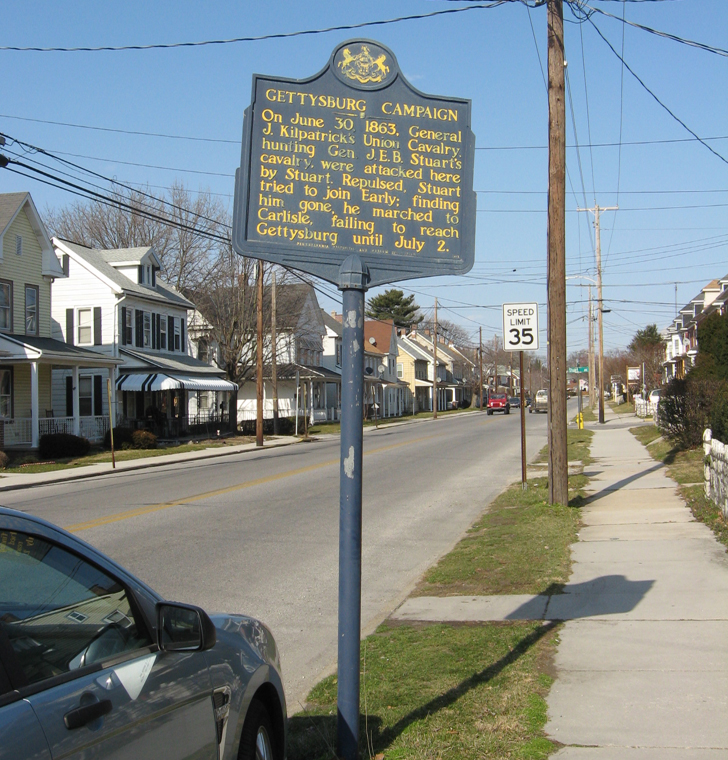
At what (x,y) coordinates should I click in order to perform the action: click on mirror. Please return your answer as a coordinate pair (x, y). This screenshot has height=760, width=728. Looking at the image, I should click on (191, 631).